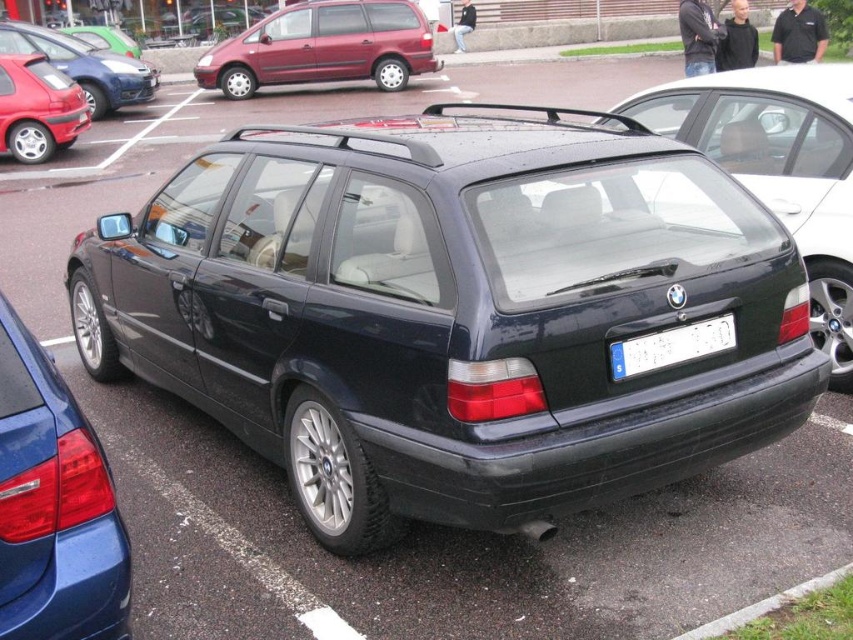
Is point (416, 20) farther from viewer compared to point (706, 337)?

Yes, point (416, 20) is farther from viewer.

Which is behind, point (390, 65) or point (730, 321)?

Point (390, 65)

Locate an element on the screen. The image size is (853, 640). maroon metallic minivan at center is located at coordinates (323, 48).

Which is below, glossy blue car at lower left or matte black car at left?

glossy blue car at lower left is lower down.

In the scene shown: Is glossy blue car at lower left smaller than matte black car at left?

Yes, glossy blue car at lower left is smaller than matte black car at left.

Is point (44, 596) positioned in front of point (62, 51)?

Yes, point (44, 596) is closer to viewer.

Find the location of a particular element. glossy blue car at lower left is located at coordinates (54, 506).

Is point (834, 320) farther from viewer compared to point (697, 330)?

Yes, it is.

Is point (816, 182) in front of point (698, 340)?

No.

Where is `satin black car at center`? satin black car at center is located at coordinates (780, 168).